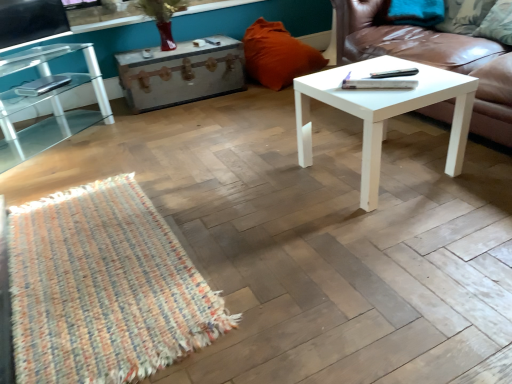
Question: Considering the positions of clear glass table at left and rustic wood trunk at center in the image, is clear glass table at left wider or thinner than rustic wood trunk at center?

Choices:
 (A) wide
 (B) thin

Answer: (A)

Question: Is point (13, 150) closer or farther from the camera than point (124, 86)?

Choices:
 (A) closer
 (B) farther

Answer: (A)

Question: Considering the real-world distances, which object is farthest from the clear glass table at left?

Choices:
 (A) white leather couch at right
 (B) orange fabric pillow at upper center, the first pillow when ordered from left to right
 (C) white matte coffee table at center
 (D) rustic wood trunk at center
 (E) green fabric pillow at upper right, which appears as the 2th pillow when viewed from the left

Answer: (E)

Question: Which object is positioned farthest from the clear glass table at left?

Choices:
 (A) white matte coffee table at center
 (B) orange fabric pillow at upper center, acting as the 1th pillow starting from the back
 (C) white leather couch at right
 (D) green fabric pillow at upper right, acting as the first pillow starting from the front
 (E) rustic wood trunk at center

Answer: (D)